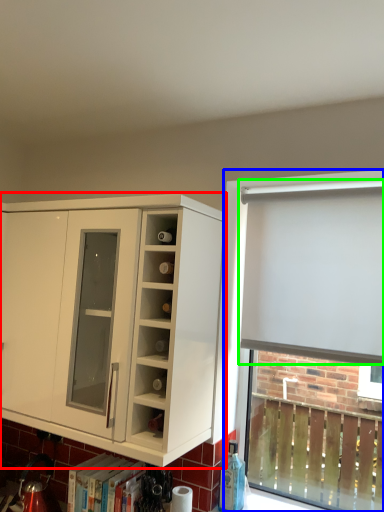
Question: Based on their relative distances, which object is farther from cabinetry (highlighted by a red box)? Choose from bay window (highlighted by a blue box) and curtain (highlighted by a green box).

Choices:
 (A) bay window
 (B) curtain

Answer: (A)